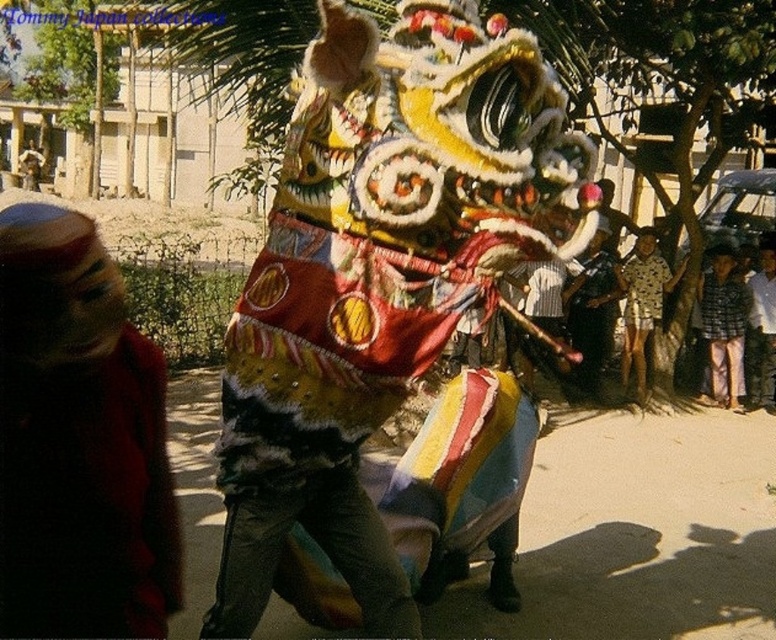
Can you confirm if red fabric headscarf at left is bigger than printed cotton shirt at center?

Incorrect, red fabric headscarf at left is not larger than printed cotton shirt at center.

Who is shorter, red fabric headscarf at left or printed cotton shirt at center?

red fabric headscarf at left

Who is more forward, (99,394) or (624,369)?

Point (99,394)

Locate an element on the screen. red fabric headscarf at left is located at coordinates (78, 440).

Is point (241, 516) farther from viewer compared to point (43, 547)?

Yes, it is behind point (43, 547).

Is multicolored fabric lion head at center wider than red fabric headscarf at left?

Yes.

Does point (397, 328) lie behind point (28, 426)?

Yes, it is.

Image resolution: width=776 pixels, height=640 pixels. I want to click on multicolored fabric lion head at center, so click(379, 275).

Describe the element at coordinates (78, 440) in the screenshot. I see `red fabric headscarf at left` at that location.

Is point (40, 451) closer to viewer compared to point (742, 371)?

Yes, it is in front of point (742, 371).

Describe the element at coordinates (78, 440) in the screenshot. I see `red fabric headscarf at left` at that location.

Image resolution: width=776 pixels, height=640 pixels. What are the coordinates of `red fabric headscarf at left` in the screenshot? It's located at (78, 440).